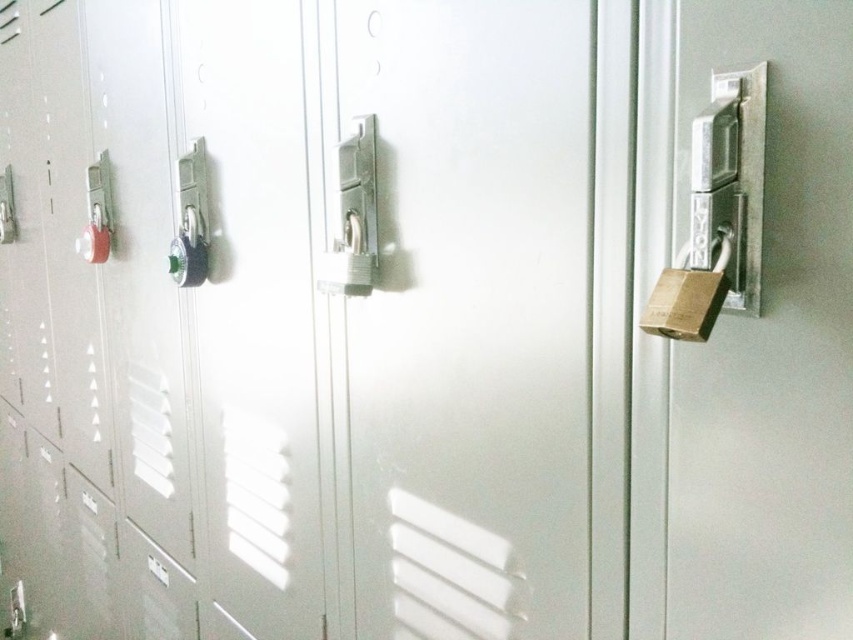
You are a maintenance worker holding a tool that is 1 meter long. You need to reach the metallic silver lock at center to perform repairs. Can your tool reach it?

The metallic silver lock at center is 98.44 centimeters from the viewer. Since the tool is 1 meter long, which is longer than 98.44 centimeters, the tool can reach the metallic silver lock at center.

You are a student trying to open your locker. You notice the gold metallic padlock at right and the matte plastic door handle at left. Which object is physically nearer to you as you stand in front of the locker?

The gold metallic padlock at right is closer to the viewer than the matte plastic door handle at left, so the gold metallic padlock at right is physically nearer to you.